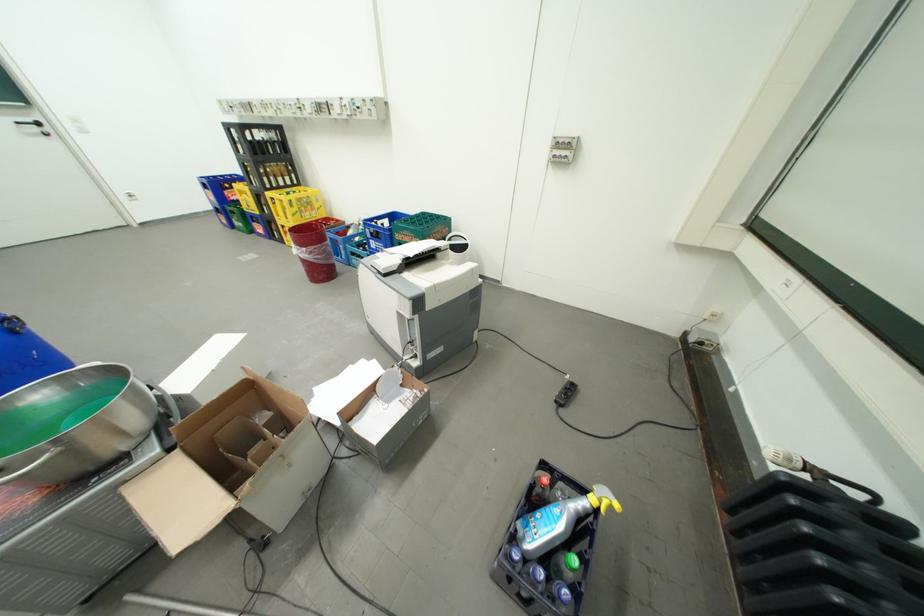
Find where to turn the black door handle. Please return your answer as a coordinate pair (x, y).

(31, 124)